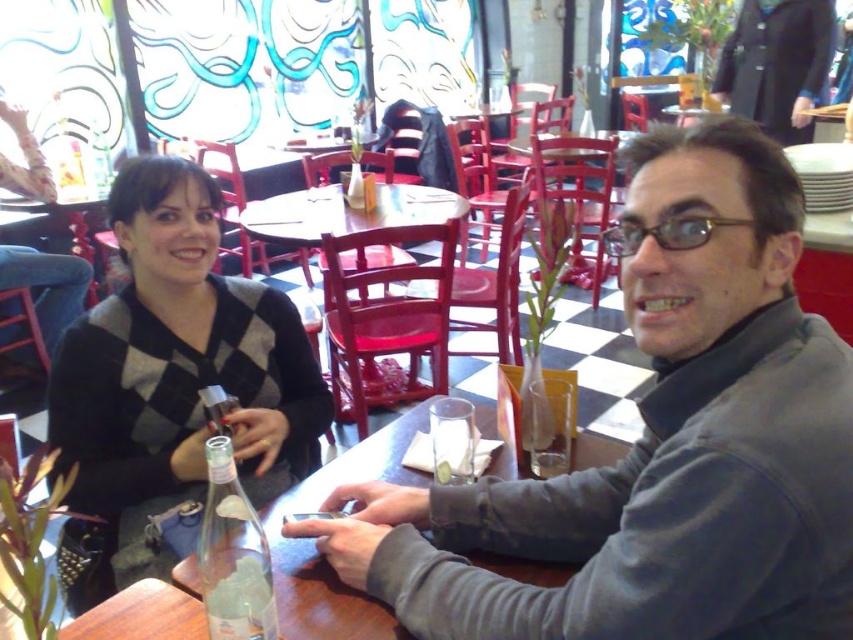
You are standing at the point with coordinates point (x=263, y=550) and want to walk to the point with coordinates point (x=506, y=563). Is the destination point behind you or in front of you?

The destination point with coordinates point (x=506, y=563) is behind the starting point at point (x=263, y=550), so it is behind you.

Looking at this image, what is the position of the point at coordinates (233,554) in the image?

The point at coordinates (233,554) is located on the clear glass bottle at table center.